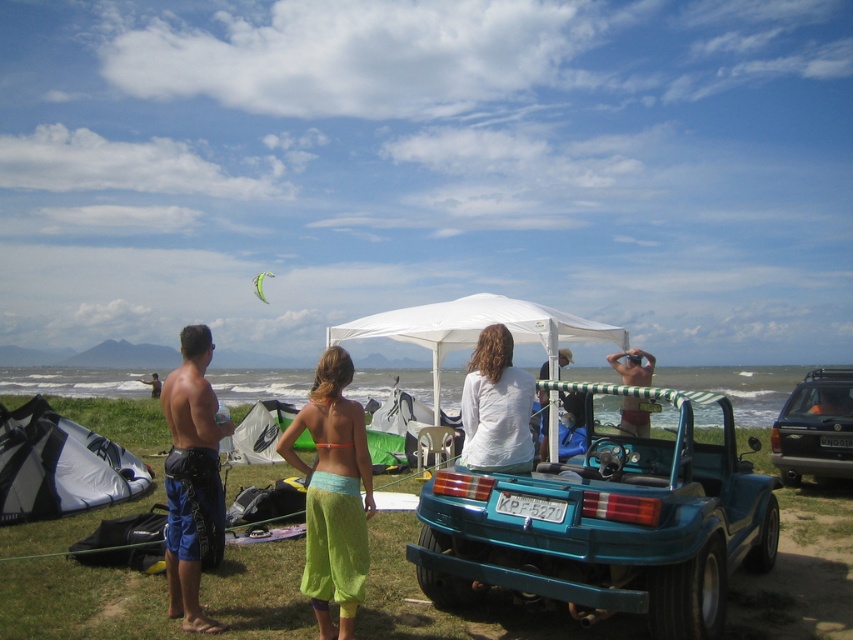
Is teal matte car at center behind metallic silver suv at right?

No, it is in front of metallic silver suv at right.

At what (x,y) coordinates should I click in order to perform the action: click on teal matte car at center. Please return your answer as a coordinate pair (x, y). This screenshot has height=640, width=853. Looking at the image, I should click on (605, 524).

Locate an element on the screen. Image resolution: width=853 pixels, height=640 pixels. teal matte car at center is located at coordinates (605, 524).

Does point (693, 604) come farther from viewer compared to point (514, 424)?

No.

Does teal matte car at center have a larger size compared to white matte shirt at center?

Yes.

Which is behind, point (436, 576) or point (492, 419)?

Point (492, 419)

I want to click on teal matte car at center, so click(605, 524).

Is white fabric kite at lower left above white matte shirt at center?

No, white fabric kite at lower left is not above white matte shirt at center.

Between white fabric kite at lower left and white matte shirt at center, which one is positioned lower?

white fabric kite at lower left is lower down.

Identify the location of white fabric kite at lower left. Image resolution: width=853 pixels, height=640 pixels. (59, 465).

Find the location of a particular element. white fabric kite at lower left is located at coordinates (59, 465).